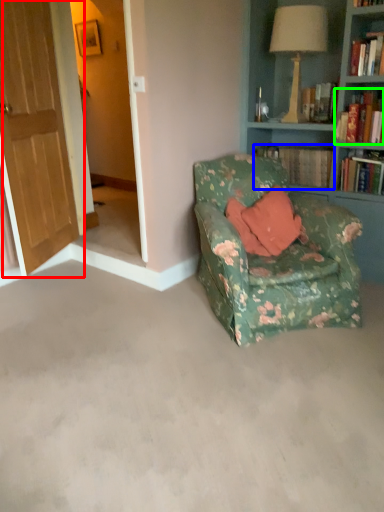
Question: Which object is positioned closest to door (highlighted by a red box)? Select from book (highlighted by a blue box) and book (highlighted by a green box).

Choices:
 (A) book
 (B) book

Answer: (A)